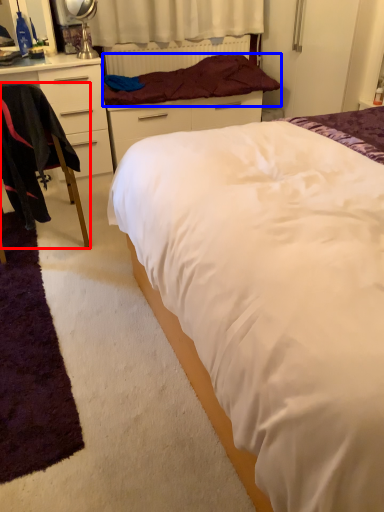
Question: Among these objects, which one is nearest to the camera, chair (highlighted by a red box) or blanket (highlighted by a blue box)?

Choices:
 (A) chair
 (B) blanket

Answer: (A)